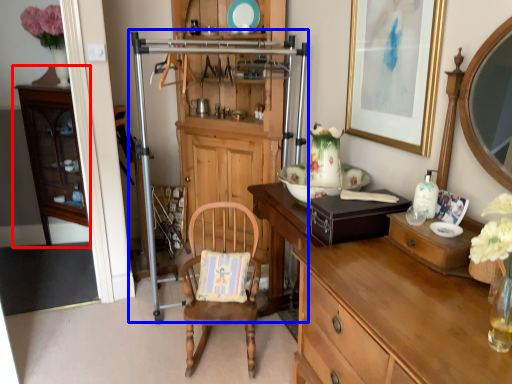
Question: Which object appears closest to the camera in this image, cabinetry (highlighted by a red box) or dresser (highlighted by a blue box)?

Choices:
 (A) cabinetry
 (B) dresser

Answer: (B)